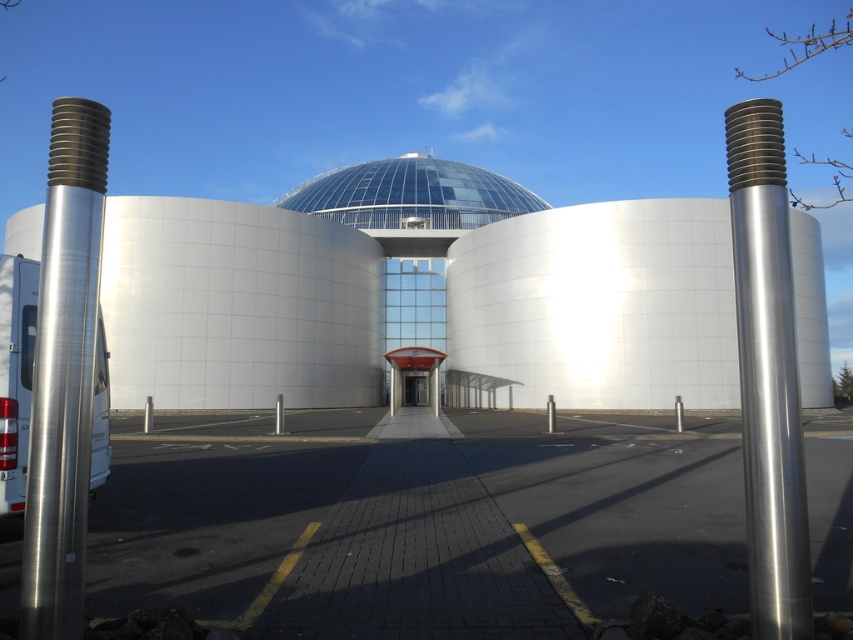
You are standing in front of the futuristic building and want to determine which of the two points, point (35,444) or point (498,211), is nearer to you. Based on the scene description, which point is closer?

Point (35,444) is closer to the viewer than point (498,211).